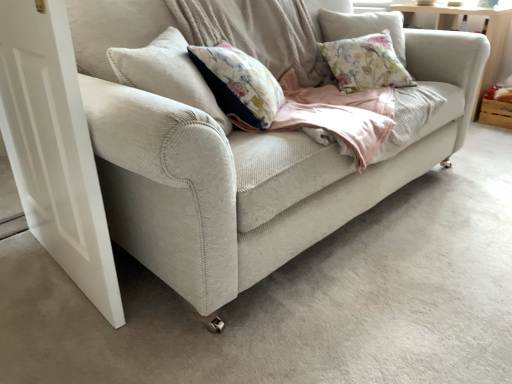
Find the location of a particular element. Image resolution: width=512 pixels, height=384 pixels. vacant area that is situated to the right of white matte door at left is located at coordinates (191, 309).